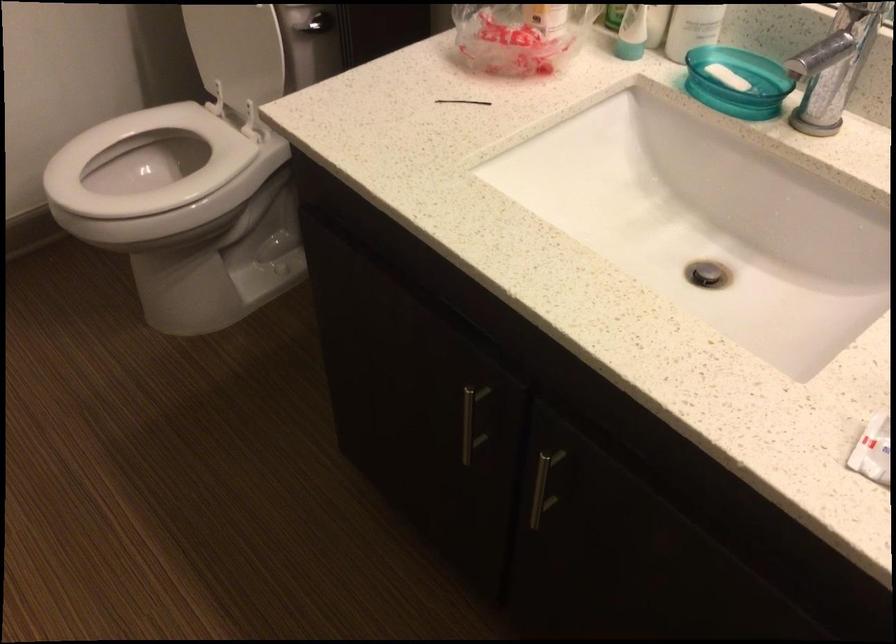
This screenshot has height=644, width=896. In order to click on white bar of soap in this screenshot , I will do `click(727, 77)`.